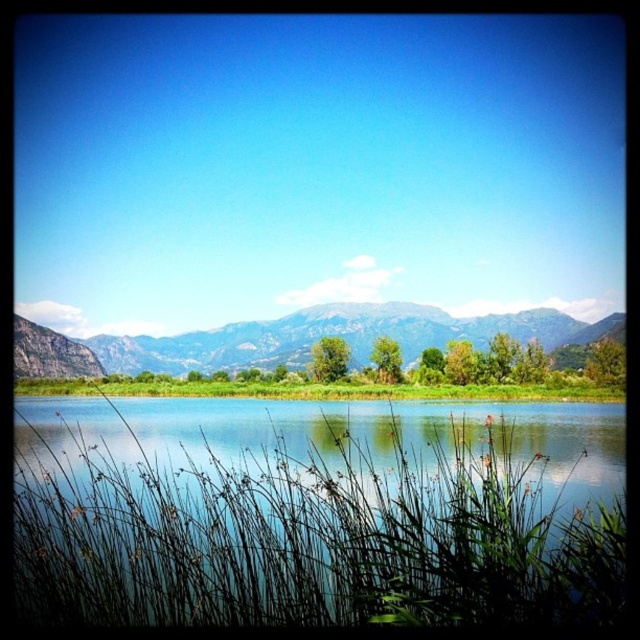
Question: Observing the image, what is the correct spatial positioning of transparent water at center in reference to rocky gray mountain at center?

Choices:
 (A) right
 (B) left

Answer: (B)

Question: Which point is farther to the camera?

Choices:
 (A) transparent water at center
 (B) green grass at center
 (C) rocky gray mountain at center

Answer: (C)

Question: Among these points, which one is nearest to the camera?

Choices:
 (A) (124, 339)
 (B) (209, 404)

Answer: (B)

Question: Is transparent water at center in front of rocky gray mountain at center?

Choices:
 (A) no
 (B) yes

Answer: (B)

Question: Which of the following is the closest to the observer?

Choices:
 (A) (104, 406)
 (B) (179, 364)
 (C) (161, 394)

Answer: (A)

Question: Is rocky gray mountain at center positioned in front of green grass at center?

Choices:
 (A) yes
 (B) no

Answer: (B)